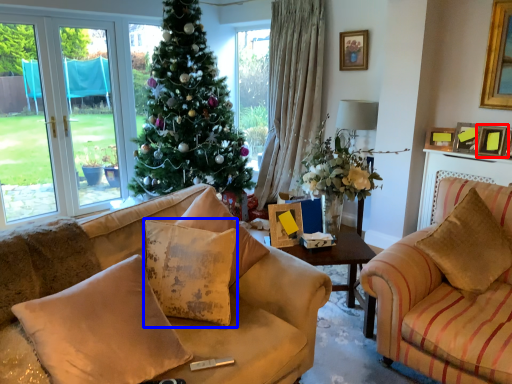
Question: Among these objects, which one is farthest to the camera, picture frame (highlighted by a red box) or pillow (highlighted by a blue box)?

Choices:
 (A) picture frame
 (B) pillow

Answer: (A)